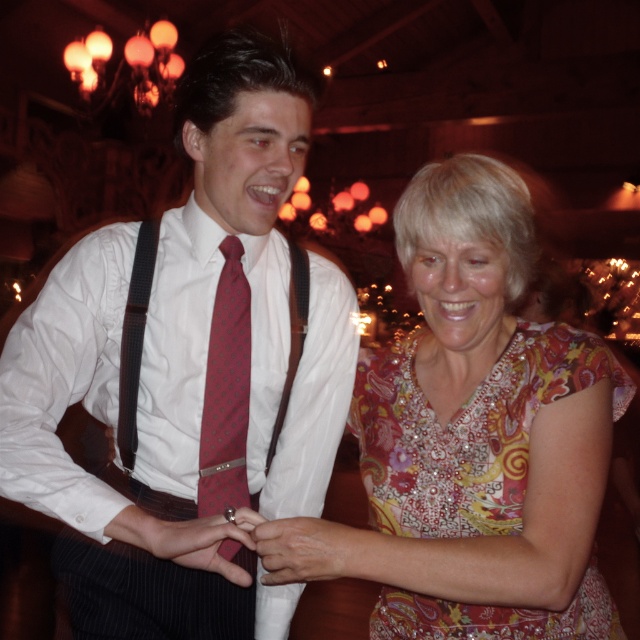
Is matte red tie at center further to camera compared to floral-patterned fabric dress at lower right?

Yes, it is.

Which of these two, matte red tie at center or floral-patterned fabric dress at lower right, stands taller?

With more height is matte red tie at center.

Identify the location of matte red tie at center. The image size is (640, 640). (188, 365).

Is matte red tie at center positioned at the back of smooth skin hand at center?

Yes, it is.

Who is positioned more to the left, matte red tie at center or smooth skin hand at center?

matte red tie at center

Is point (19, 323) in front of point (212, 518)?

No, (19, 323) is further to viewer.

The height and width of the screenshot is (640, 640). Find the location of `matte red tie at center`. matte red tie at center is located at coordinates (188, 365).

Is floral-patterned fabric dress at lower right shorter than polka dot silk tie at center?

Yes.

Between point (426, 401) and point (220, 289), which one is positioned in front?

Point (426, 401) is in front.

Image resolution: width=640 pixels, height=640 pixels. I want to click on floral-patterned fabric dress at lower right, so click(x=467, y=432).